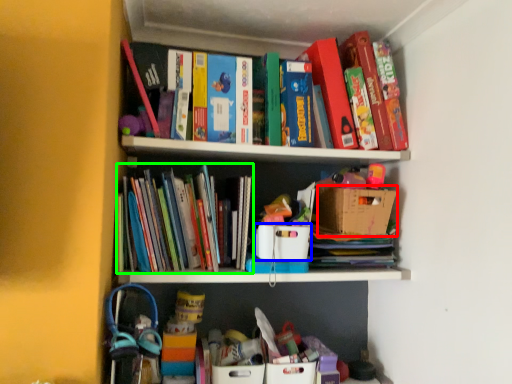
Question: Estimate the real-world distances between objects in this image. Which object is farther from cardboard box (highlighted by a red box), cardboard box (highlighted by a blue box) or book (highlighted by a green box)?

Choices:
 (A) cardboard box
 (B) book

Answer: (B)